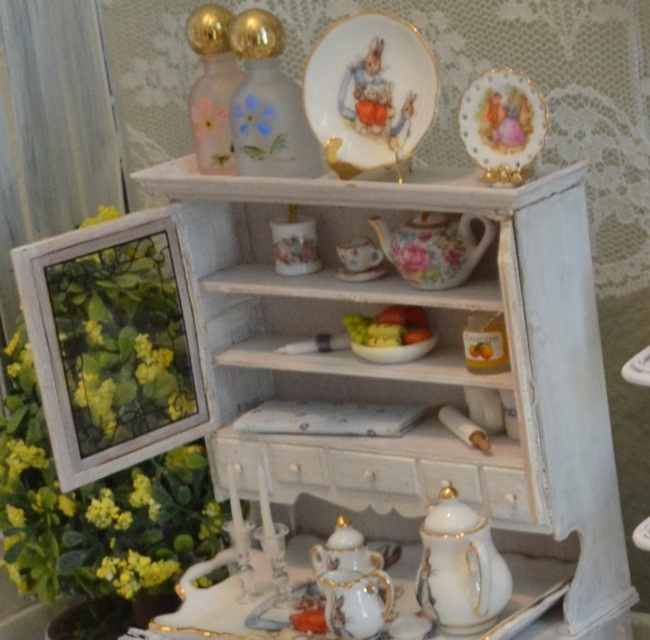
You are standing in front of the vintage corner cabinet and want to reach the porcelain plate at upper center. Considering your height and arm length, can you safely reach it without using a stool?

The porcelain plate at upper center is 1.21 meters from the camera. If your arm length allows you to reach up to that height, then yes, you can safely reach it without a stool. Otherwise, a stool might be necessary.